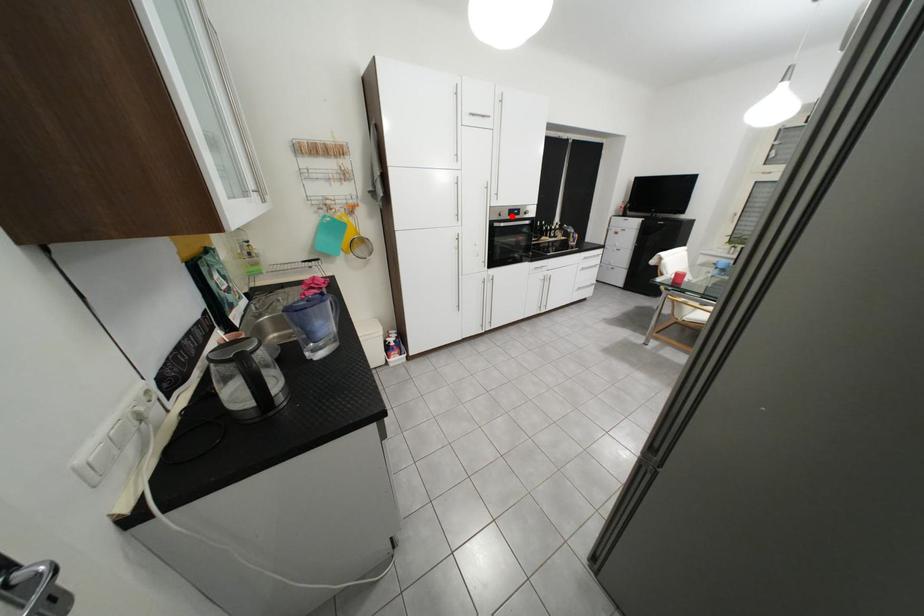
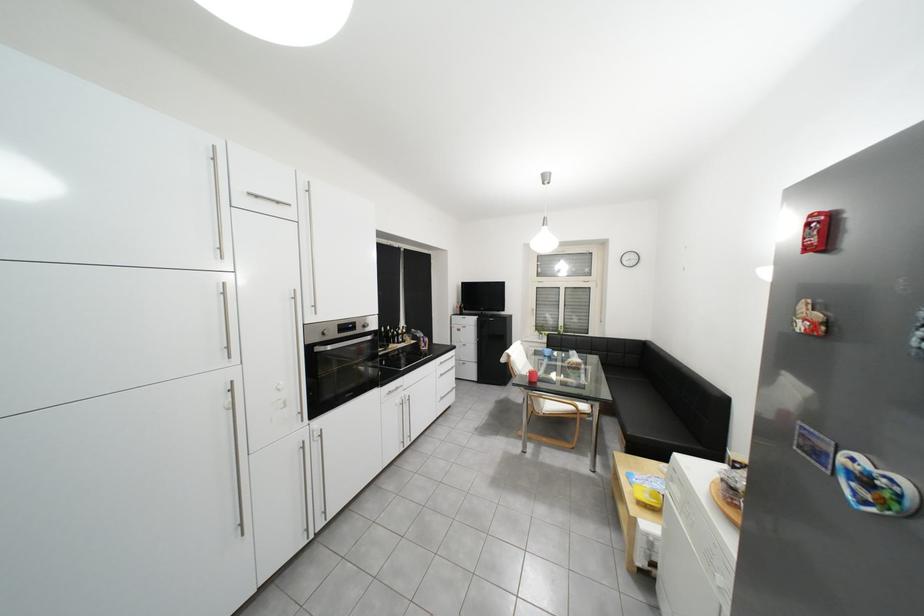
Question: I am providing you with two images of the same scene from different viewpoints. In image1, a red point is highlighted. Considering the same 3D point in image2, which of the following is correct?

Choices:
 (A) It is closer
 (B) It is farther

Answer: (B)